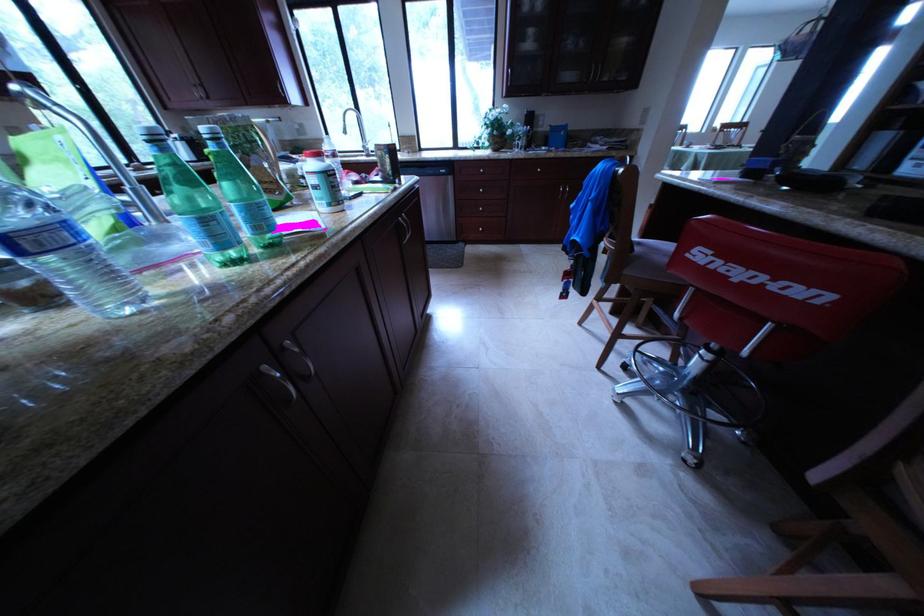
Image resolution: width=924 pixels, height=616 pixels. I want to click on metal faucet handle, so click(x=91, y=147).